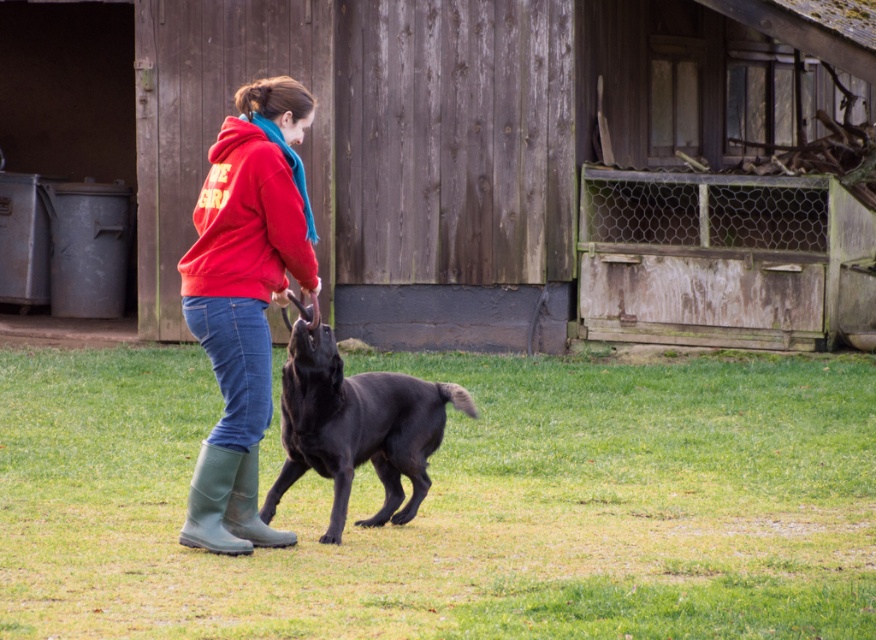
Does shiny black dog at center have a greater height compared to green rubber boot at lower center?

Correct, shiny black dog at center is much taller as green rubber boot at lower center.

Can you confirm if shiny black dog at center is positioned to the right of green rubber boot at lower center?

Correct, you'll find shiny black dog at center to the right of green rubber boot at lower center.

Identify the location of shiny black dog at center. (357, 428).

Which is behind, point (843, 28) or point (246, 246)?

Point (843, 28)

Is point (602, 77) less distant than point (246, 236)?

No, (602, 77) is further to viewer.

Locate an element on the screen. The width and height of the screenshot is (876, 640). weathered wood barn at center is located at coordinates pyautogui.click(x=526, y=163).

Consider the image. Who is lower down, black rubber boots at lower left or shiny black dog at center?

Positioned lower is black rubber boots at lower left.

Can you confirm if black rubber boots at lower left is positioned to the left of shiny black dog at center?

No, black rubber boots at lower left is not to the left of shiny black dog at center.

Who is more forward, (447, 582) or (274, 502)?

Point (447, 582) is in front.

This screenshot has height=640, width=876. Find the location of `black rubber boots at lower left`. black rubber boots at lower left is located at coordinates (456, 504).